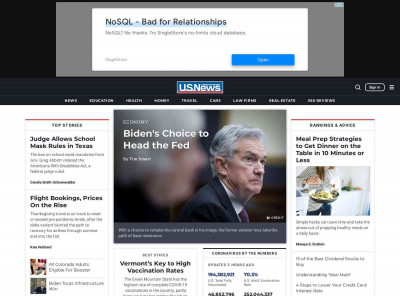
The height and width of the screenshot is (296, 400). In order to click on counter in this screenshot , I will do `click(345, 206)`.